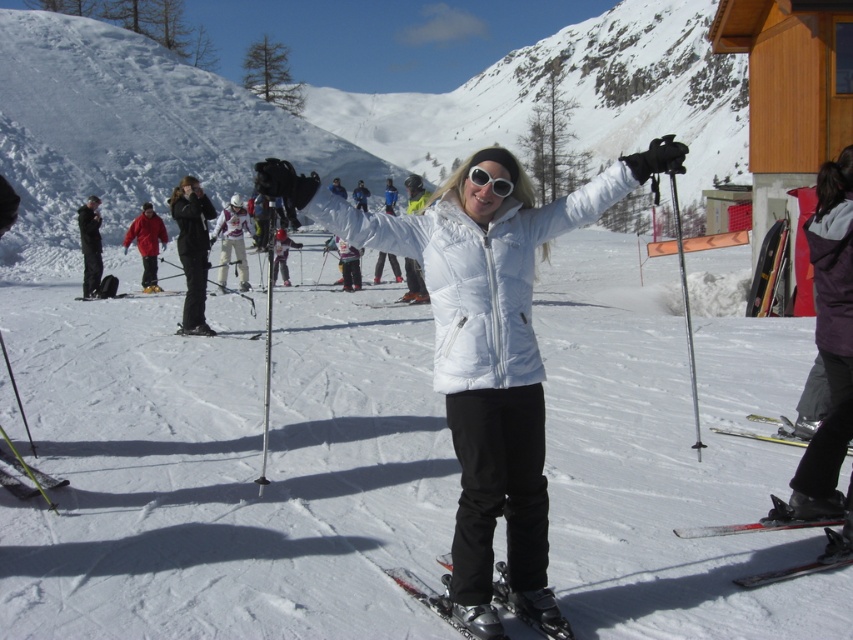
Can you confirm if black matte snow pants at left is shorter than white matte sunglasses at center?

In fact, black matte snow pants at left may be taller than white matte sunglasses at center.

Is the position of black matte snow pants at left less distant than that of white matte sunglasses at center?

No, black matte snow pants at left is further to the viewer.

Does point (80, 218) come closer to viewer compared to point (485, 177)?

That is False.

The height and width of the screenshot is (640, 853). In order to click on black matte snow pants at left in this screenshot , I will do `click(90, 244)`.

Consider the image. Who is taller, red metallic ski at lower right or yellow metallic ski at lower right?

With more height is red metallic ski at lower right.

Which is below, red metallic ski at lower right or yellow metallic ski at lower right?

red metallic ski at lower right

Measure the distance between point (x=755, y=584) and camera.

Point (x=755, y=584) is 4.39 meters away from camera.

The width and height of the screenshot is (853, 640). In order to click on red metallic ski at lower right in this screenshot , I will do `click(813, 561)`.

Does red jacket at center appear over green metallic ski at lower left?

Yes.

Between red jacket at center and green metallic ski at lower left, which one appears on the right side from the viewer's perspective?

Positioned to the right is green metallic ski at lower left.

Locate an element on the screen. The height and width of the screenshot is (640, 853). red jacket at center is located at coordinates (148, 243).

Image resolution: width=853 pixels, height=640 pixels. What are the coordinates of `red jacket at center` in the screenshot? It's located at (148, 243).